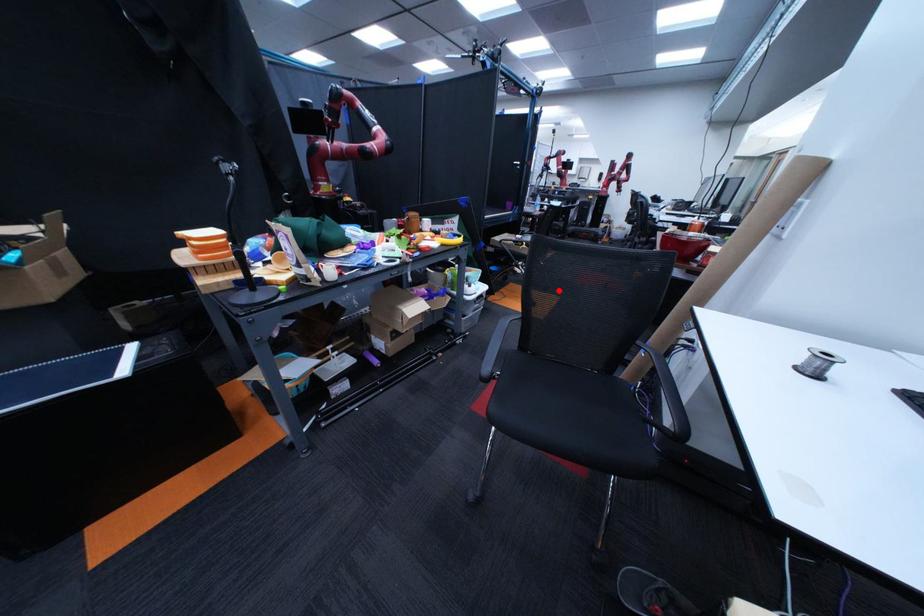
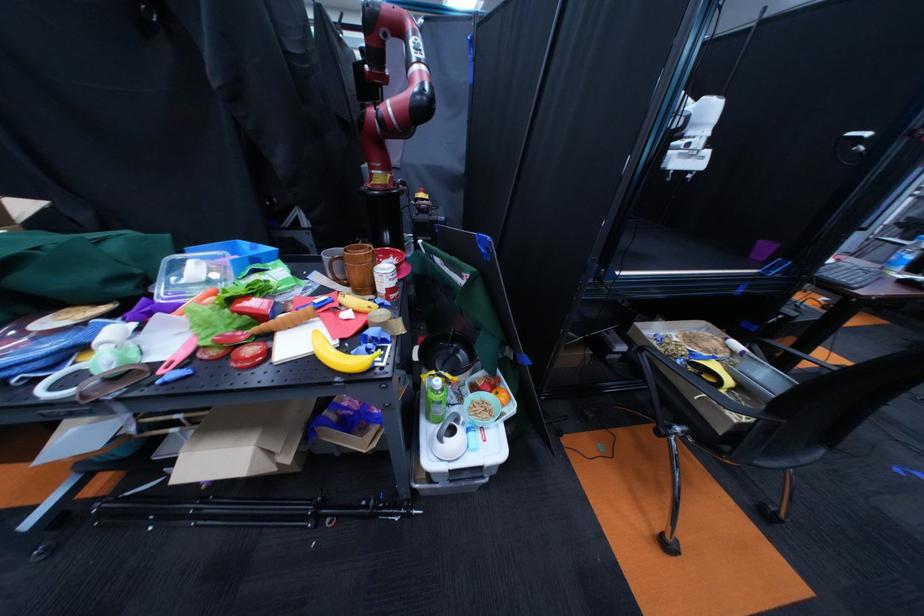
Question: I am providing you with two images of the same scene from different viewpoints. Given a red point in image1, look at the same physical point in image2. Is it:

Choices:
 (A) Closer to the viewpoint
 (B) Farther from the viewpoint

Answer: (A)